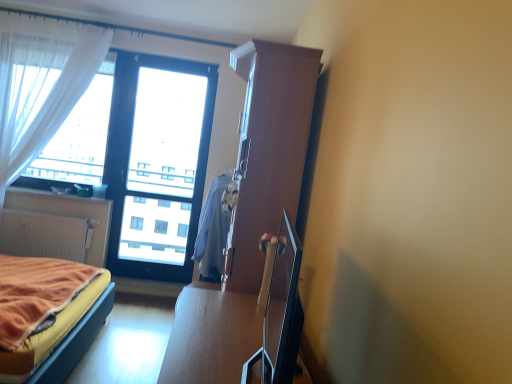
At what (x,y) coordinates should I click in order to perform the action: click on empty space that is ontop of matte white radiator at lower left (from a real-world perspective). Please return your answer as a coordinate pair (x, y). Looking at the image, I should click on (49, 211).